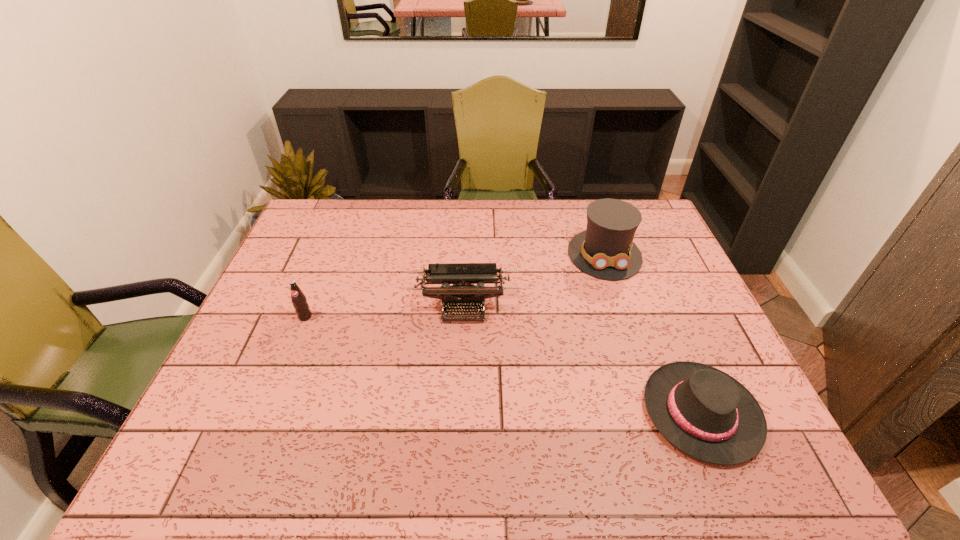
In order to click on the third closest object to the tallest object in this screenshot , I will do `click(299, 300)`.

This screenshot has height=540, width=960. Identify the location of free region that satisfies the following two spatial constraints: 1. on the typing side of the third object from right to left; 2. on the left side of the shorter dress hat. (460, 413).

You are a GUI agent. You are given a task and a screenshot of the screen. Output one action in this format:
    pyautogui.click(x=<x>, y=<y>)
    Task: Click on the blank space that satisfies the following two spatial constraints: 1. with goggles on the front of the farthest object; 2. on the left side of the shorter dress hat
    This screenshot has height=540, width=960.
    Given the screenshot: What is the action you would take?
    pyautogui.click(x=657, y=413)

The height and width of the screenshot is (540, 960). I want to click on vacant space that satisfies the following two spatial constraints: 1. on the typing side of the typewriter; 2. on the left side of the shortest object, so click(x=460, y=413).

Where is `free space in the image that satisfies the following two spatial constraints: 1. on the typing side of the shorter dress hat; 2. on the left side of the typewriter`? The height and width of the screenshot is (540, 960). free space in the image that satisfies the following two spatial constraints: 1. on the typing side of the shorter dress hat; 2. on the left side of the typewriter is located at coordinates (460, 413).